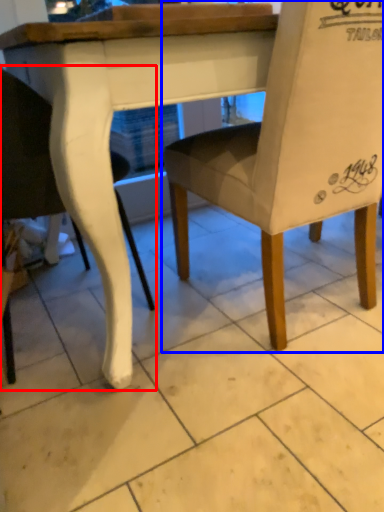
Question: Among these objects, which one is nearest to the camera, chair (highlighted by a red box) or chair (highlighted by a blue box)?

Choices:
 (A) chair
 (B) chair

Answer: (B)